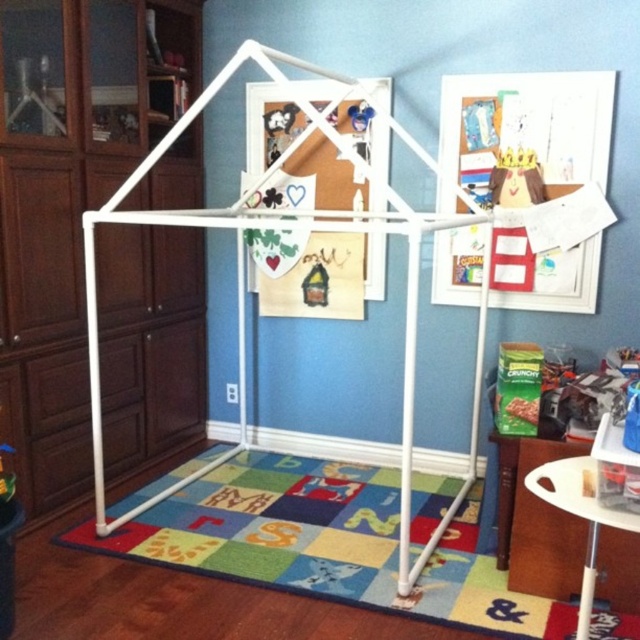
Question: Which of the following is the closest to the observer?

Choices:
 (A) white plastic stool at lower right
 (B) matte cardboard picture frame at upper center

Answer: (A)

Question: Is white plastic stool at lower right thinner than matte plastic toy at center?

Choices:
 (A) no
 (B) yes

Answer: (A)

Question: Can you confirm if matte cardboard picture frame at upper center is smaller than white plastic stool at lower right?

Choices:
 (A) yes
 (B) no

Answer: (B)

Question: Based on their relative distances, which object is nearer to the matte cardboard picture frame at center?

Choices:
 (A) matte cardboard picture frame at upper center
 (B) white plastic stool at lower right

Answer: (A)

Question: Is matte cardboard picture frame at upper center above white plastic stool at lower right?

Choices:
 (A) no
 (B) yes

Answer: (B)

Question: Which point is farther to the camera?

Choices:
 (A) (605, 108)
 (B) (269, 104)
 (C) (273, 150)
 (D) (632, 524)

Answer: (C)